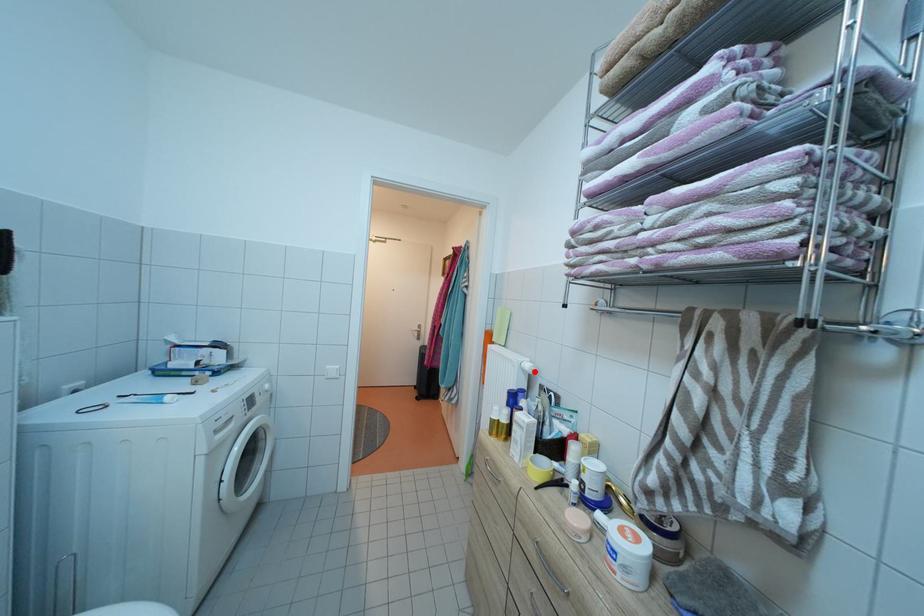
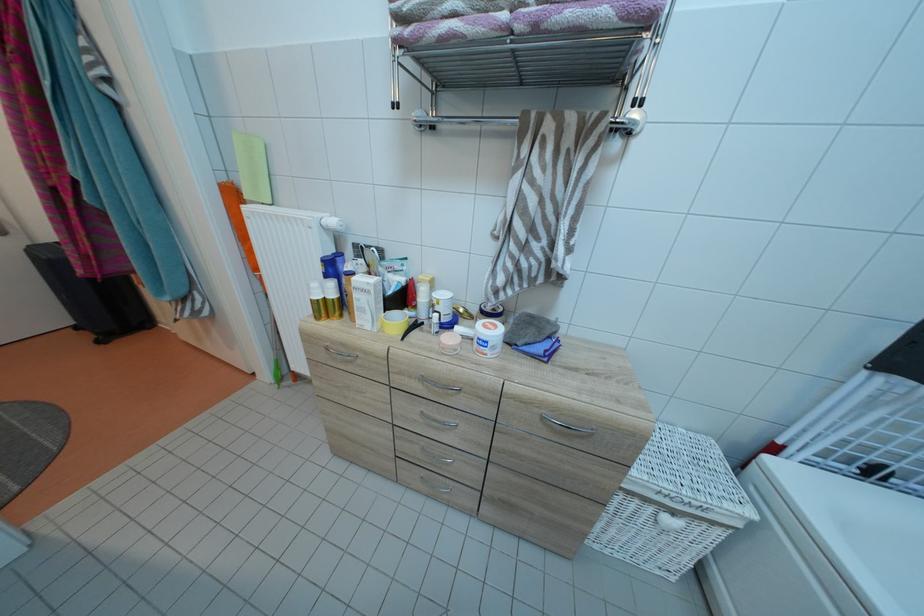
In the second image, find the point that corresponds to the highlighted location in the first image.

(341, 227)